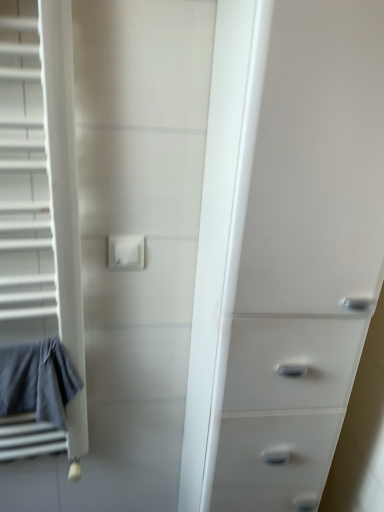
Question: Relative to gray cotton bath towel at left, is white plastic electric outlet at center in front or behind?

Choices:
 (A) behind
 (B) front

Answer: (A)

Question: From a real-world perspective, is white plastic electric outlet at center positioned above or below gray cotton bath towel at left?

Choices:
 (A) below
 (B) above

Answer: (B)

Question: Which is nearer to the white plastic chest of drawers at right?

Choices:
 (A) white plastic electric outlet at center
 (B) gray cotton bath towel at left

Answer: (A)

Question: Which object is the farthest from the white plastic electric outlet at center?

Choices:
 (A) gray cotton bath towel at left
 (B) white plastic chest of drawers at right

Answer: (B)